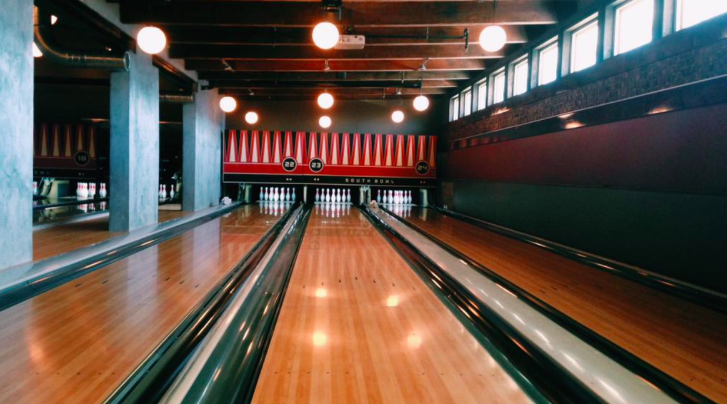
This screenshot has height=404, width=727. Find the location of `ceiling beams`. ceiling beams is located at coordinates (381, 17), (387, 35), (392, 55), (392, 65), (393, 78), (392, 92).